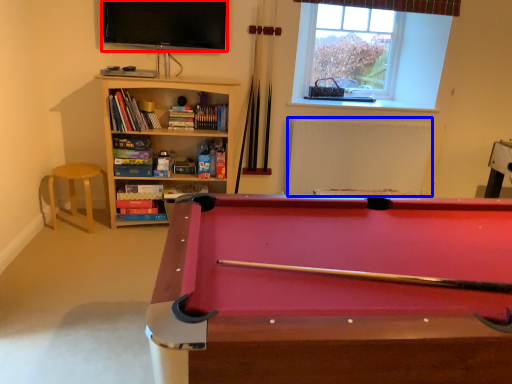
Question: Among these objects, which one is farthest to the camera, television (highlighted by a red box) or radiator (highlighted by a blue box)?

Choices:
 (A) television
 (B) radiator

Answer: (B)